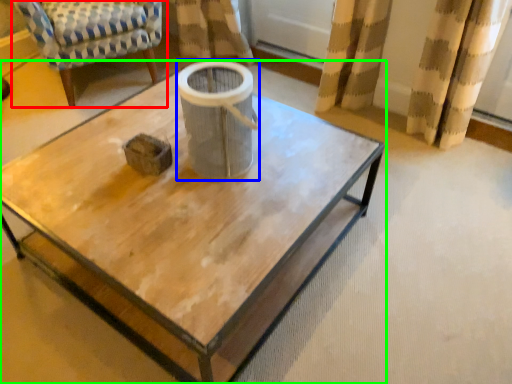
Question: Which object is the farthest from chair (highlighted by a red box)? Choose among these: gray (highlighted by a blue box) or coffee table (highlighted by a green box).

Choices:
 (A) gray
 (B) coffee table

Answer: (A)